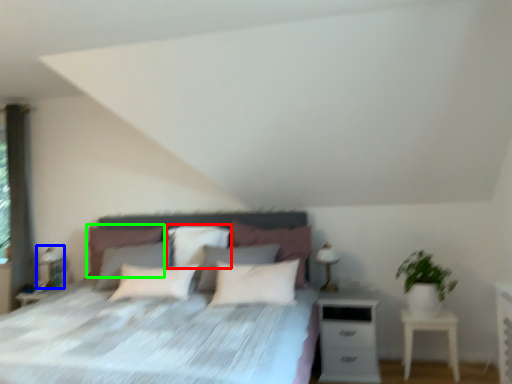
Question: Based on their relative distances, which object is farther from pillow (highlighted by a red box)? Choose from table lamp (highlighted by a blue box) and pillow (highlighted by a green box).

Choices:
 (A) table lamp
 (B) pillow

Answer: (A)